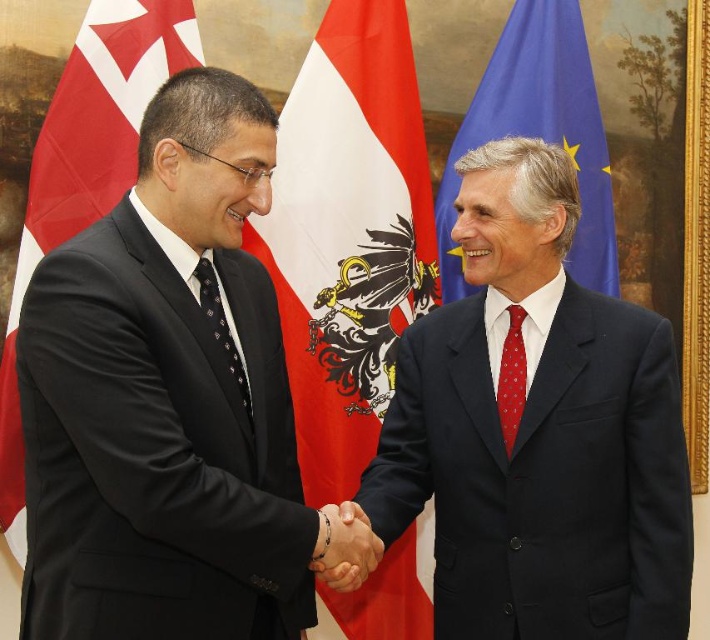
You are a photographer at the meeting. You want to capture a closeup shot of the handshake between the two individuals. However, you notice the blue fabric flag at upper right is partially blocking your view. Can you adjust your camera angle to fully frame the smooth skin handshake at center without the flag overlapping?

The blue fabric flag at upper right is wider than the smooth skin handshake at center, so adjusting the camera angle might allow you to position the flag out of the frame while keeping the handshake visible. Since the flag is wider, moving the camera slightly to the left or right could shift the flag out of the shot while still capturing the handshake.

You are a photographer in a diplomatic meeting. You need to capture a photo of the smooth skin handshake at center. The camera is set to focus at point 0.855, 0.487. Will the handshake be in focus?

Yes, the smooth skin handshake at center is located at point (344, 547), so the camera focus will capture it clearly.

You are an event photographer at this meeting. You need to capture a photo where the smooth skin handshake at center is visible above the red dotted fabric tie at center. Is this possible based on their current positions?

The smooth skin handshake at center is below the red dotted fabric tie at center, so it is not possible to capture the handshake above the tie in this position.